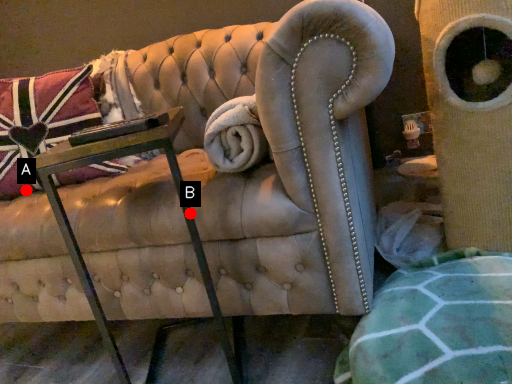
Question: Two points are circled on the image, labeled by A and B beside each circle. Which of the following is the farthest from the observer?

Choices:
 (A) A is further
 (B) B is further

Answer: (A)